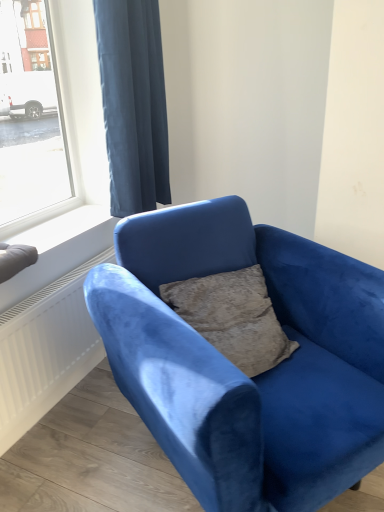
I want to click on velvet blue couch at center, so click(x=238, y=369).

What do you see at coordinates (62, 227) in the screenshot?
I see `white smooth window sill at lower left` at bounding box center [62, 227].

Identify the location of velvet blue couch at center. Image resolution: width=384 pixels, height=512 pixels. (238, 369).

From a real-world perspective, which is physically above, white smooth window sill at lower left or velvet blue couch at center?

white smooth window sill at lower left.

Considering the positions of objects white smooth window sill at lower left and velvet blue couch at center in the image provided, who is behind, white smooth window sill at lower left or velvet blue couch at center?

white smooth window sill at lower left is behind.

Is white smooth window sill at lower left at the right side of velvet blue couch at center?

Incorrect, white smooth window sill at lower left is not on the right side of velvet blue couch at center.

Considering the sizes of objects white smooth window sill at lower left and velvet blue couch at center in the image provided, who is bigger, white smooth window sill at lower left or velvet blue couch at center?

With larger size is velvet blue couch at center.

In the scene shown: Which object is further away from the camera taking this photo, white smooth window sill at lower left or dark blue fabric curtain at upper left?

white smooth window sill at lower left is more distant.

Is white smooth window sill at lower left touching dark blue fabric curtain at upper left?

white smooth window sill at lower left and dark blue fabric curtain at upper left are not in contact.

Considering the relative sizes of white smooth window sill at lower left and dark blue fabric curtain at upper left in the image provided, is white smooth window sill at lower left smaller than dark blue fabric curtain at upper left?

Correct, white smooth window sill at lower left occupies less space than dark blue fabric curtain at upper left.

Is white smooth window sill at lower left thinner than dark blue fabric curtain at upper left?

No, white smooth window sill at lower left is not thinner than dark blue fabric curtain at upper left.

From their relative heights in the image, would you say velvet blue couch at center is taller or shorter than dark blue fabric curtain at upper left?

Considering their sizes, velvet blue couch at center has less height than dark blue fabric curtain at upper left.

Can you confirm if velvet blue couch at center is bigger than dark blue fabric curtain at upper left?

Correct, velvet blue couch at center is larger in size than dark blue fabric curtain at upper left.

From the image's perspective, is velvet blue couch at center located above or below dark blue fabric curtain at upper left?

From the image's perspective, velvet blue couch at center appears below dark blue fabric curtain at upper left.

Which is closer, (x=150, y=403) or (x=153, y=87)?

Point (x=150, y=403)

Considering the points (120, 130) and (226, 370), which point is behind, point (120, 130) or point (226, 370)?

The point (120, 130) is farther from the camera.

Is dark blue fabric curtain at upper left directly adjacent to velvet blue couch at center?

No, dark blue fabric curtain at upper left is not next to velvet blue couch at center.

Is dark blue fabric curtain at upper left to the left or to the right of velvet blue couch at center in the image?

From the image, it's evident that dark blue fabric curtain at upper left is to the left of velvet blue couch at center.

Who is taller, dark blue fabric curtain at upper left or velvet blue couch at center?

dark blue fabric curtain at upper left.

Is dark blue fabric curtain at upper left oriented towards white smooth window sill at lower left?

No, dark blue fabric curtain at upper left is not turned towards white smooth window sill at lower left.

Is white smooth window sill at lower left completely or partially inside dark blue fabric curtain at upper left?

No, white smooth window sill at lower left is located outside of dark blue fabric curtain at upper left.

Who is smaller, dark blue fabric curtain at upper left or white smooth window sill at lower left?

Smaller between the two is white smooth window sill at lower left.

Is dark blue fabric curtain at upper left positioned far away from white smooth window sill at lower left?

dark blue fabric curtain at upper left is actually quite close to white smooth window sill at lower left.

From a real-world perspective, which is physically above, velvet blue couch at center or white smooth window sill at lower left?

In real-world perspective, white smooth window sill at lower left is above.

Is velvet blue couch at center turned away from white smooth window sill at lower left?

Yes, velvet blue couch at center's orientation is away from white smooth window sill at lower left.

From the image's perspective, relative to white smooth window sill at lower left, is velvet blue couch at center above or below?

From the image's perspective, velvet blue couch at center appears below white smooth window sill at lower left.

Is velvet blue couch at center behind white smooth window sill at lower left?

That is False.

Where is `window sill behind the velvet blue couch at center`? window sill behind the velvet blue couch at center is located at coordinates (62, 227).

The height and width of the screenshot is (512, 384). I want to click on window sill below the dark blue fabric curtain at upper left (from a real-world perspective), so click(62, 227).

When comparing their distances from dark blue fabric curtain at upper left, does white smooth window sill at lower left or velvet blue couch at center seem closer?

white smooth window sill at lower left.

Considering their positions, is white smooth window sill at lower left positioned closer to velvet blue couch at center than dark blue fabric curtain at upper left?

white smooth window sill at lower left is positioned closer to the anchor velvet blue couch at center.

Based on the photo, estimate the real-world distances between objects in this image. Which object is closer to white smooth window sill at lower left, velvet blue couch at center or dark blue fabric curtain at upper left?

The object closer to white smooth window sill at lower left is dark blue fabric curtain at upper left.

Looking at the image, which one is located further to white smooth window sill at lower left, dark blue fabric curtain at upper left or velvet blue couch at center?

velvet blue couch at center is positioned further to the anchor white smooth window sill at lower left.

Which object lies nearer to the anchor point dark blue fabric curtain at upper left, velvet blue couch at center or white smooth window sill at lower left?

The object closer to dark blue fabric curtain at upper left is white smooth window sill at lower left.

Based on their spatial positions, is dark blue fabric curtain at upper left or white smooth window sill at lower left closer to velvet blue couch at center?

white smooth window sill at lower left lies closer to velvet blue couch at center than the other object.

The height and width of the screenshot is (512, 384). I want to click on curtain located between velvet blue couch at center and white smooth window sill at lower left in the depth direction, so click(x=133, y=104).